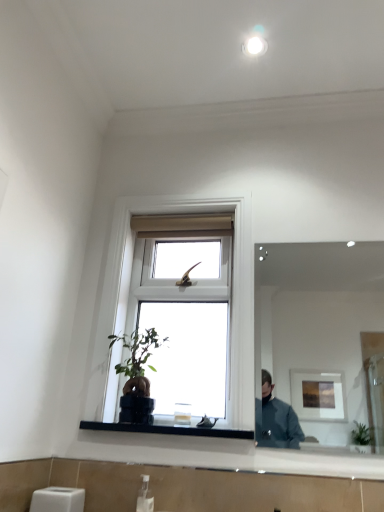
Identify the location of white plastic soap dispenser at lower center. The width and height of the screenshot is (384, 512). (145, 496).

Where is `white glossy light fixture at upper center`? white glossy light fixture at upper center is located at coordinates (254, 46).

Where is `clear glass mirror at upper right`? The height and width of the screenshot is (512, 384). clear glass mirror at upper right is located at coordinates (315, 335).

Does white glossy light fixture at upper center appear on the right side of white wood window at center?

Yes, white glossy light fixture at upper center is to the right of white wood window at center.

Is white glossy light fixture at upper center facing towards white wood window at center?

No, white glossy light fixture at upper center is not turned towards white wood window at center.

Is white glossy light fixture at upper center positioned behind white wood window at center?

That is True.

How much distance is there between white glossy light fixture at upper center and white wood window at center?

white glossy light fixture at upper center is 39.08 inches away from white wood window at center.

Is green leafy plant at center aimed at white plastic soap dispenser at lower center?

No, green leafy plant at center is not facing towards white plastic soap dispenser at lower center.

The width and height of the screenshot is (384, 512). Find the location of `soap dispenser in front of the green leafy plant at center`. soap dispenser in front of the green leafy plant at center is located at coordinates (145, 496).

Between green leafy plant at center and white plastic soap dispenser at lower center, which one appears on the right side from the viewer's perspective?

Positioned to the right is white plastic soap dispenser at lower center.

Is white plastic soap dispenser at lower center at the back of black glass at lower center?

That's not correct — black glass at lower center is not looking away from white plastic soap dispenser at lower center.

Are black glass at lower center and white plastic soap dispenser at lower center far apart?

No, there isn't a large distance between black glass at lower center and white plastic soap dispenser at lower center.

How different are the orientations of black glass at lower center and white plastic soap dispenser at lower center in degrees?

The facing directions of black glass at lower center and white plastic soap dispenser at lower center are 0.0492 degrees apart.

Is black glass at lower center to the left or to the right of white plastic soap dispenser at lower center in the image?

Based on their positions, black glass at lower center is located to the right of white plastic soap dispenser at lower center.

From the image's perspective, which one is positioned lower, clear glass mirror at upper right or white glossy light fixture at upper center?

clear glass mirror at upper right, from the image's perspective.

Is clear glass mirror at upper right beside white glossy light fixture at upper center?

No, clear glass mirror at upper right is not beside white glossy light fixture at upper center.

Is clear glass mirror at upper right oriented away from white glossy light fixture at upper center?

No, white glossy light fixture at upper center is not at the back of clear glass mirror at upper right.

Which of these two, clear glass mirror at upper right or white glossy light fixture at upper center, stands taller?

clear glass mirror at upper right.

Is black glass at lower center directly adjacent to white wood window at center?

No, black glass at lower center is not touching white wood window at center.

Can you tell me how much black glass at lower center and white wood window at center differ in facing direction?

0.744 degrees.

Is point (133, 426) closer to camera compared to point (115, 216)?

Yes, point (133, 426) is in front of point (115, 216).

Is black glass at lower center at the right side of white wood window at center?

Incorrect, black glass at lower center is not on the right side of white wood window at center.

Does point (138, 206) appear closer or farther from the camera than point (268, 321)?

Point (138, 206) appears to be closer to the viewer than point (268, 321).

Considering the positions of objects white wood window at center and clear glass mirror at upper right in the image provided, who is behind, white wood window at center or clear glass mirror at upper right?

white wood window at center is more distant.

Looking at this image, does white wood window at center turn towards clear glass mirror at upper right?

No, white wood window at center is not aimed at clear glass mirror at upper right.

Can you confirm if white wood window at center is wider than clear glass mirror at upper right?

Yes, white wood window at center is wider than clear glass mirror at upper right.

Consider the image. Is green leafy plant at center turned away from white glossy light fixture at upper center?

No, green leafy plant at center is not facing away from white glossy light fixture at upper center.

Considering the sizes of objects green leafy plant at center and white glossy light fixture at upper center in the image provided, who is bigger, green leafy plant at center or white glossy light fixture at upper center?

green leafy plant at center is bigger.

Which object is positioned more to the right, green leafy plant at center or white glossy light fixture at upper center?

Positioned to the right is white glossy light fixture at upper center.

At what (x,y) coordinates should I click in order to perform the action: click on window that appears in front of the white glossy light fixture at upper center. Please return your answer as a coordinate pair (x, y). The image size is (384, 512). Looking at the image, I should click on (232, 295).

Where is `soap dispenser below the green leafy plant at center (from the image's perspective)`? soap dispenser below the green leafy plant at center (from the image's perspective) is located at coordinates (145, 496).

Estimate the real-world distances between objects in this image. Which object is closer to white plastic soap dispenser at lower center, white glossy light fixture at upper center or green leafy plant at center?

green leafy plant at center is positioned closer to the anchor white plastic soap dispenser at lower center.

Estimate the real-world distances between objects in this image. Which object is closer to green leafy plant at center, white plastic soap dispenser at lower center or white wood window at center?

white wood window at center lies closer to green leafy plant at center than the other object.

When comparing their distances from black glass at lower center, does white plastic soap dispenser at lower center or white wood window at center seem further?

The object further to black glass at lower center is white wood window at center.

Considering their positions, is white wood window at center positioned closer to white glossy light fixture at upper center than clear glass mirror at upper right?

The object closer to white glossy light fixture at upper center is white wood window at center.

When comparing their distances from green leafy plant at center, does white glossy light fixture at upper center or clear glass mirror at upper right seem closer?

A: white glossy light fixture at upper center lies closer to green leafy plant at center than the other object.

Which object lies further to the anchor point white glossy light fixture at upper center, green leafy plant at center or white wood window at center?

green leafy plant at center.

Which object lies nearer to the anchor point white wood window at center, white glossy light fixture at upper center or clear glass mirror at upper right?

white glossy light fixture at upper center is closer to white wood window at center.

Based on the photo, based on their spatial positions, is green leafy plant at center or white glossy light fixture at upper center further from black glass at lower center?

Based on the image, white glossy light fixture at upper center appears to be further to black glass at lower center.

Find the location of `houseplant between white glossy light fixture at upper center and white plastic soap dispenser at lower center from top to bottom`. houseplant between white glossy light fixture at upper center and white plastic soap dispenser at lower center from top to bottom is located at coordinates (137, 373).

The width and height of the screenshot is (384, 512). In order to click on window sill between white plastic soap dispenser at lower center and clear glass mirror at upper right in the horizontal direction in this screenshot , I will do `click(169, 430)`.

This screenshot has width=384, height=512. What are the coordinates of `window between green leafy plant at center and clear glass mirror at upper right from left to right` in the screenshot? It's located at (232, 295).

Find the location of a particular element. This screenshot has width=384, height=512. houseplant between white wood window at center and white plastic soap dispenser at lower center vertically is located at coordinates (137, 373).